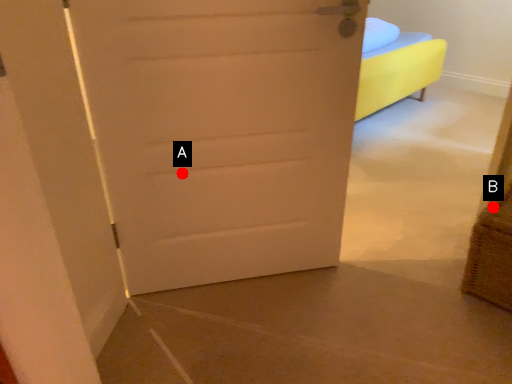
Question: Two points are circled on the image, labeled by A and B beside each circle. Which of the following is the farthest from the observer?

Choices:
 (A) A is further
 (B) B is further

Answer: (B)